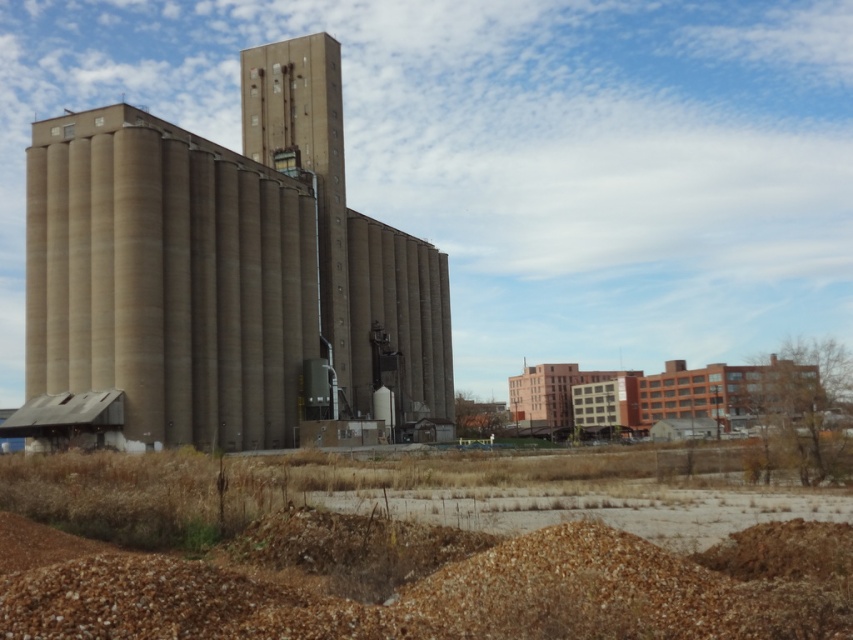
Question: Which object is farther from the camera taking this photo?

Choices:
 (A) brown gravel at lower center
 (B) concrete silo at center

Answer: (B)

Question: Does brown gravel at lower center appear over concrete silo at center?

Choices:
 (A) yes
 (B) no

Answer: (B)

Question: Can you confirm if brown gravel at lower center is smaller than concrete silo at center?

Choices:
 (A) no
 (B) yes

Answer: (B)

Question: Can you confirm if brown gravel at lower center is bigger than concrete silo at center?

Choices:
 (A) no
 (B) yes

Answer: (A)